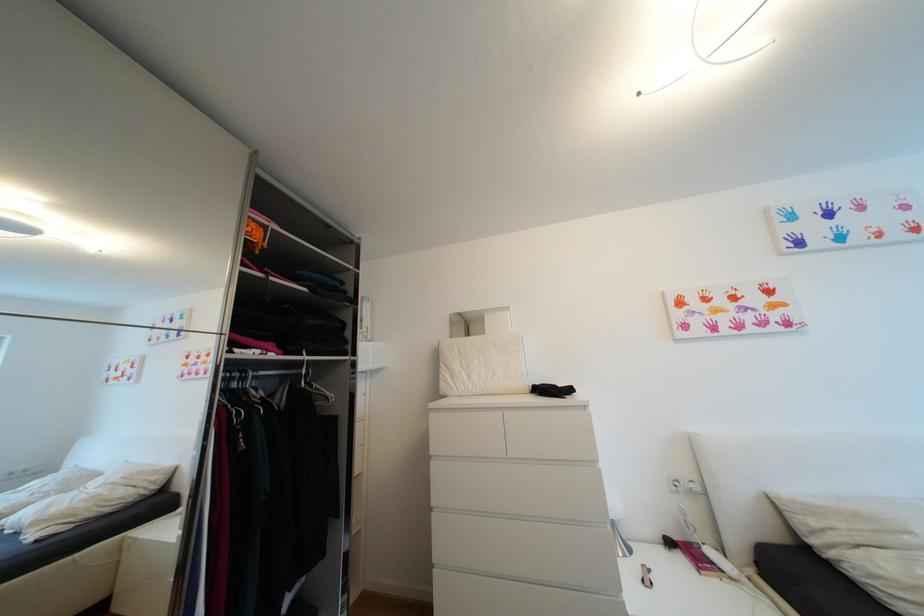
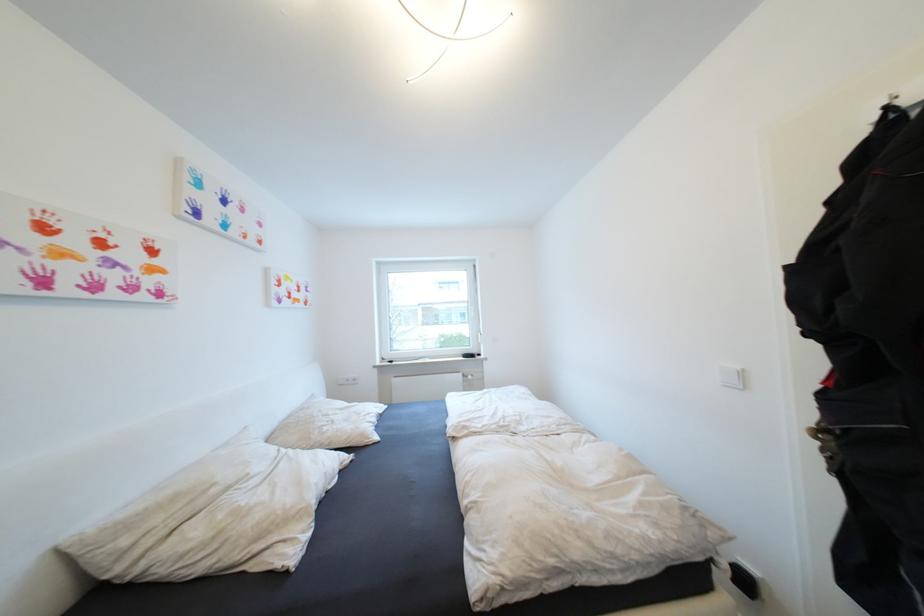
Question: The camera is either moving clockwise (left) or counter-clockwise (right) around the object. The first image is from the beginning of the video and the second image is from the end. Is the camera moving left or right when shooting the video?

Choices:
 (A) Left
 (B) Right

Answer: (A)